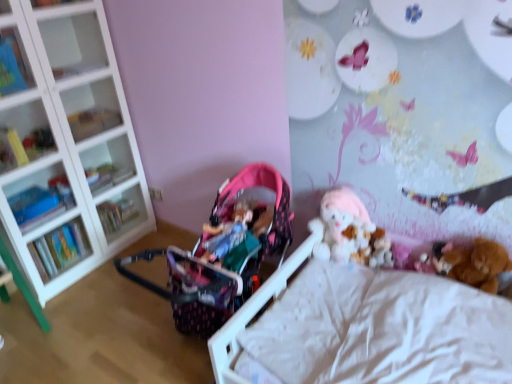
Question: From a real-world perspective, is matte plastic shelf at upper left, the first shelf viewed from the top, above or below brown plush bear at lower right, which is the third toy from left to right?

Choices:
 (A) above
 (B) below

Answer: (A)

Question: From the image's perspective, is matte plastic shelf at upper left, which is counted as the fifth shelf, starting from the bottom, located above or below brown plush bear at lower right, which is counted as the first toy, starting from the right?

Choices:
 (A) above
 (B) below

Answer: (A)

Question: Based on their relative distances, which object is farther from the hardcover book at left?

Choices:
 (A) clear glass shelves at left, the fourth shelf in the top-to-bottom sequence
 (B) fuzzy brown teddy bear at lower right, the second toy from the left
 (C) brown plush bear at lower right, which is counted as the first toy, starting from the right
 (D) matte plastic shelf at upper left, which is counted as the fifth shelf, starting from the bottom
 (E) matte plastic books at left, the first shelf when ordered from bottom to top

Answer: (C)

Question: Estimate the real-world distances between objects in this image. Which object is closer to the fluffy pink plush at center, which appears as the third toy when viewed from the right?

Choices:
 (A) fuzzy brown teddy bear at lower right, marked as the 2th toy in a right-to-left arrangement
 (B) hardcover book at left
 (C) white glass shelf at left, the third shelf ordered from the bottom
 (D) matte plastic books at left, positioned as the 5th shelf in top-to-bottom order
 (E) matte plastic shelf at upper left, the first shelf viewed from the top

Answer: (A)